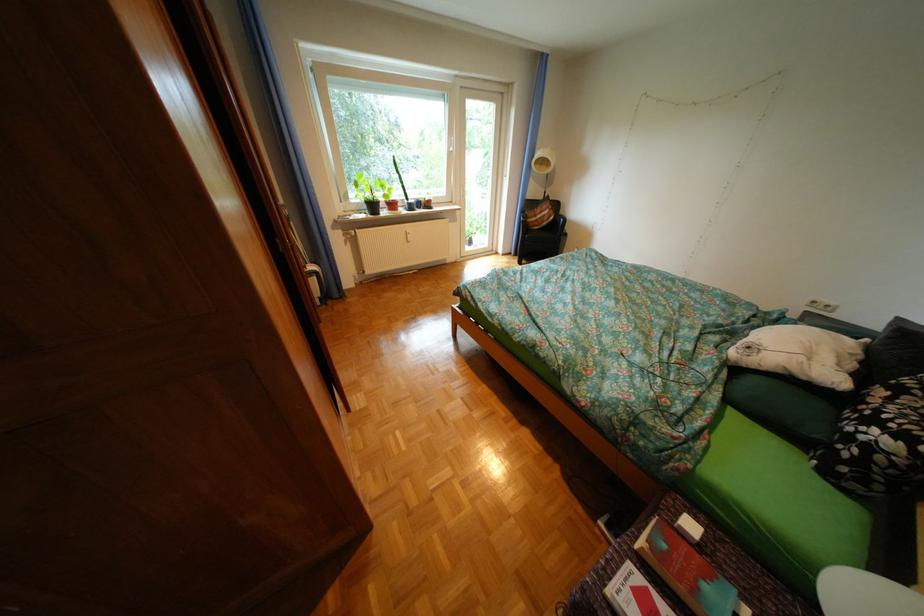
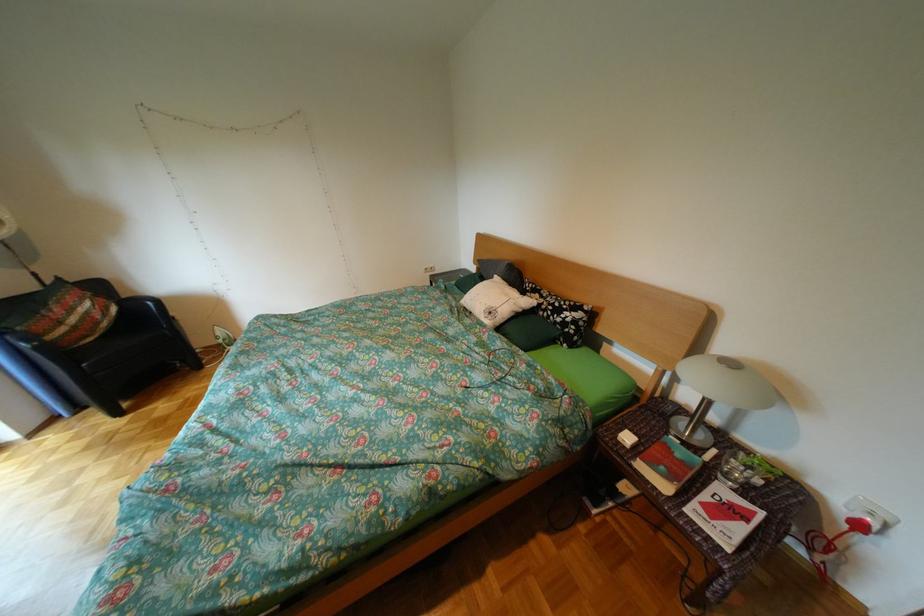
How did the camera likely rotate?

The camera's rotation is toward right-down.